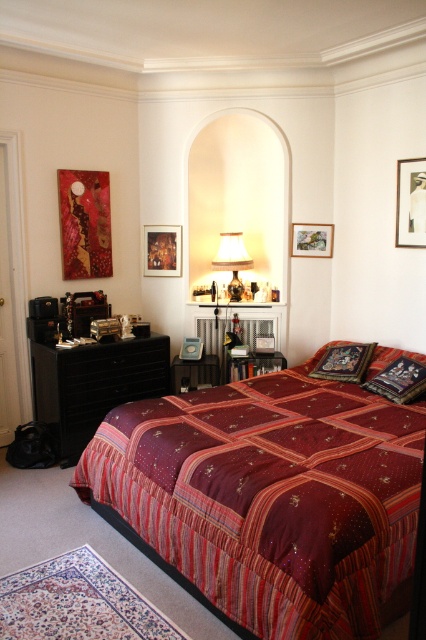
You are arranging a photo shoot in this bedroom and need to position a camera on a tripod. The camera needs to be placed so that both the embroidered silk pillow at center and the matte glass lampshade at center are visible in the frame. Given their positions, which object should you focus on first to ensure both are in the shot?

The embroidered silk pillow at center is positioned under the matte glass lampshade at center. To ensure both are in the frame, focus on the matte glass lampshade at center first, as it is above the pillow and adjusting the camera angle to include it will naturally include the pillow below.

You are standing in the bedroom and want to take a photo of both point (x=339, y=346) and point (x=238, y=289) in the image. Since you can only focus on one point at a time, which point should you focus on first to ensure both points are in focus?

You should focus on point (x=238, y=289) first because it is farther from the camera than point (x=339, y=346). By focusing on the farther point, the closer point will also be within the depth of field, ensuring both are in focus.